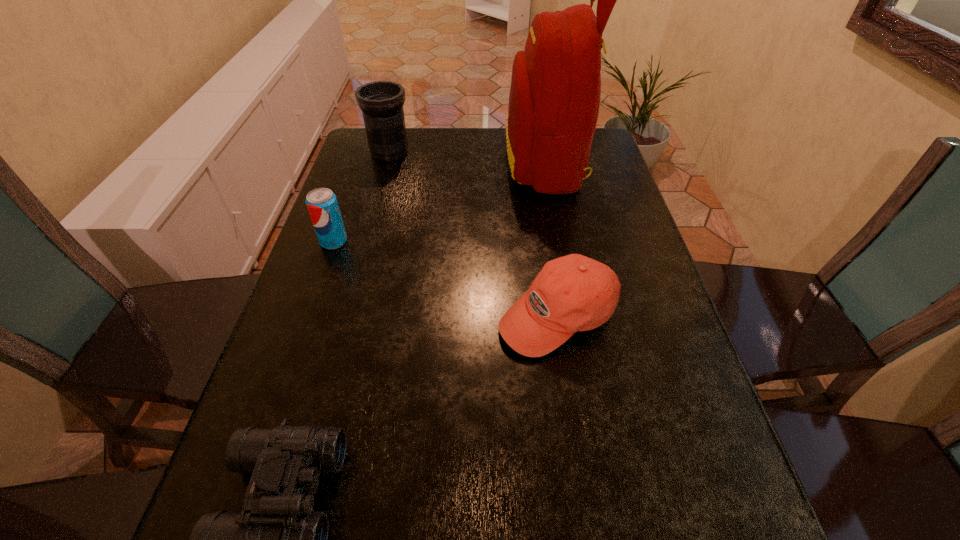
The image size is (960, 540). In the image, there is a desktop. Identify the location of free space at the right edge. (658, 281).

Where is `free point between the soda can and the second tallest object`? free point between the soda can and the second tallest object is located at coordinates (362, 197).

The width and height of the screenshot is (960, 540). In order to click on vacant area that lies between the soda can and the baseball cap in this screenshot , I will do `click(445, 279)`.

The width and height of the screenshot is (960, 540). Identify the location of vacant space that's between the third farthest object and the fourth shortest object. (362, 197).

You are a GUI agent. You are given a task and a screenshot of the screen. Output one action in this format:
    pyautogui.click(x=<x>, y=<y>)
    Task: Click on the unoccupied position between the backpack and the telephoto lens
    This screenshot has height=540, width=960.
    Given the screenshot: What is the action you would take?
    pyautogui.click(x=468, y=158)

At what (x,y) coordinates should I click in order to perform the action: click on free space between the second tallest object and the backpack. Please return your answer as a coordinate pair (x, y). The width and height of the screenshot is (960, 540). Looking at the image, I should click on (468, 158).

Identify the location of object that is the fourth closest to the fourth shortest object. The image size is (960, 540). (272, 539).

Identify the location of object that ranks as the third closest to the fourth shortest object. The height and width of the screenshot is (540, 960). (572, 293).